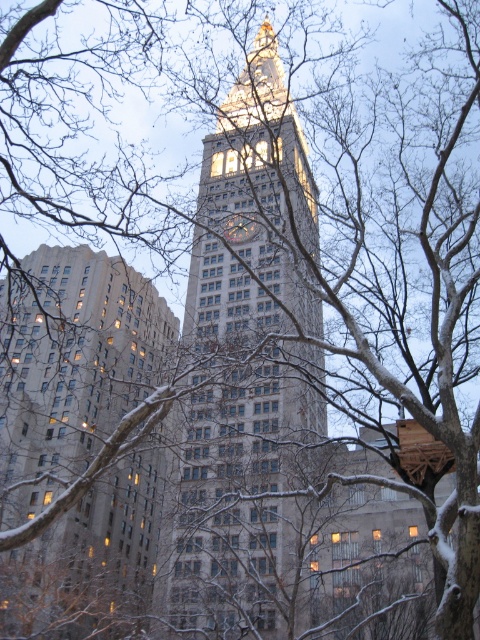
Question: Which point is closer to the camera?

Choices:
 (A) stone clock tower at center
 (B) gray stone building at center

Answer: (A)

Question: Is stone clock tower at center to the right of gray stone building at center from the viewer's perspective?

Choices:
 (A) no
 (B) yes

Answer: (B)

Question: Is stone clock tower at center further to camera compared to gray stone building at center?

Choices:
 (A) no
 (B) yes

Answer: (A)

Question: Is stone clock tower at center below gray stone building at center?

Choices:
 (A) yes
 (B) no

Answer: (B)